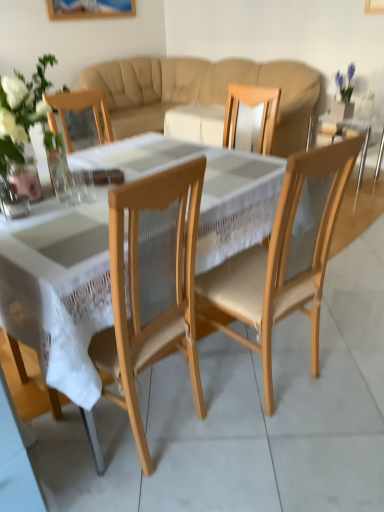
This screenshot has width=384, height=512. What are the coordinates of `free space between clear glass at center, the second tableware in the right-to-left sequence, and clear glass vase at left` in the screenshot? It's located at (50, 201).